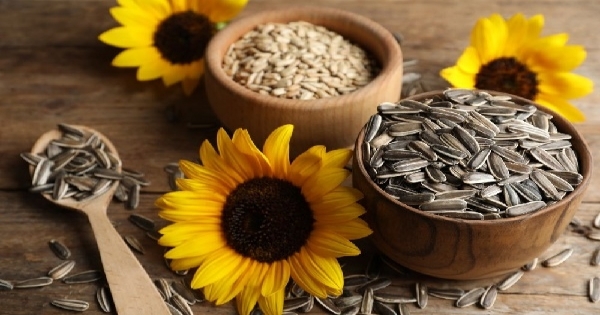
Locate an element on the screen. This screenshot has width=600, height=315. wooden spoon handle is located at coordinates (116, 252).